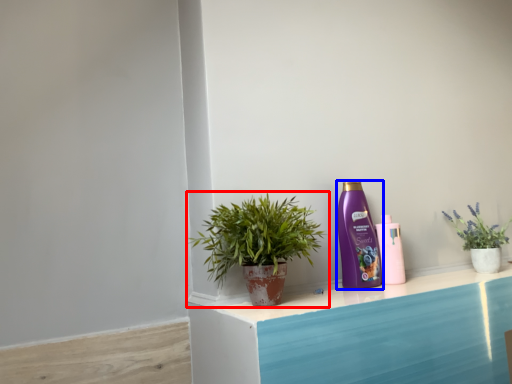
Question: Which object appears closest to the camera in this image, houseplant (highlighted by a red box) or bottle (highlighted by a blue box)?

Choices:
 (A) houseplant
 (B) bottle

Answer: (A)